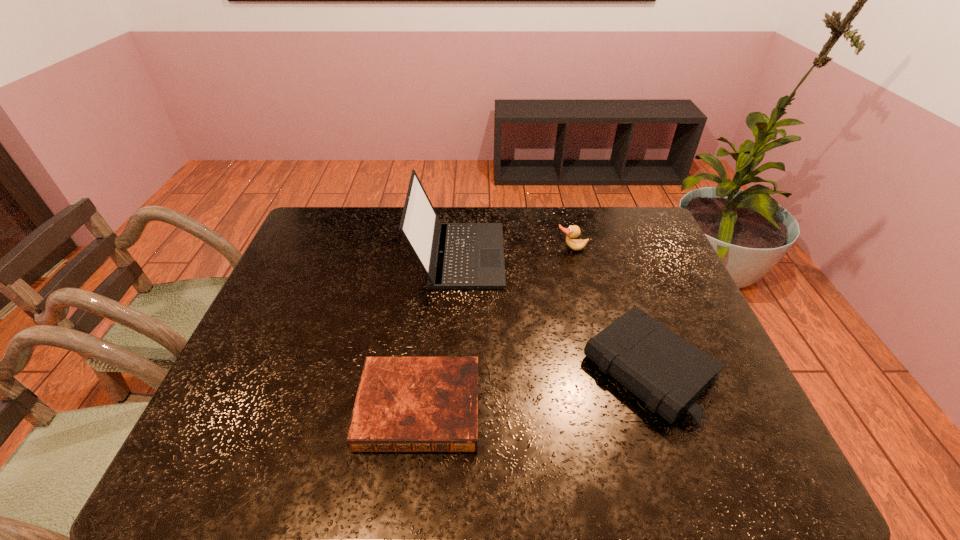
This screenshot has width=960, height=540. Find the location of `laptop`. laptop is located at coordinates (453, 255).

Locate an element on the screen. The width and height of the screenshot is (960, 540). the second tallest object is located at coordinates (573, 231).

Image resolution: width=960 pixels, height=540 pixels. Identify the location of the taller Bible. (666, 372).

Locate an element on the screen. the right Bible is located at coordinates (666, 372).

Find the location of `the left Bible`. the left Bible is located at coordinates (403, 404).

Image resolution: width=960 pixels, height=540 pixels. I want to click on the shorter Bible, so click(x=403, y=404).

Where is `blank space located 0.070m on the surface of the laptop`? blank space located 0.070m on the surface of the laptop is located at coordinates (526, 255).

Where is `vacant space situated on the beak of the duck`? vacant space situated on the beak of the duck is located at coordinates (582, 290).

Where is `vacant space located 0.400m on the left of the taller Bible`? The width and height of the screenshot is (960, 540). vacant space located 0.400m on the left of the taller Bible is located at coordinates (418, 370).

Image resolution: width=960 pixels, height=540 pixels. What are the coordinates of `laptop located in the far edge section of the desktop` in the screenshot? It's located at (453, 255).